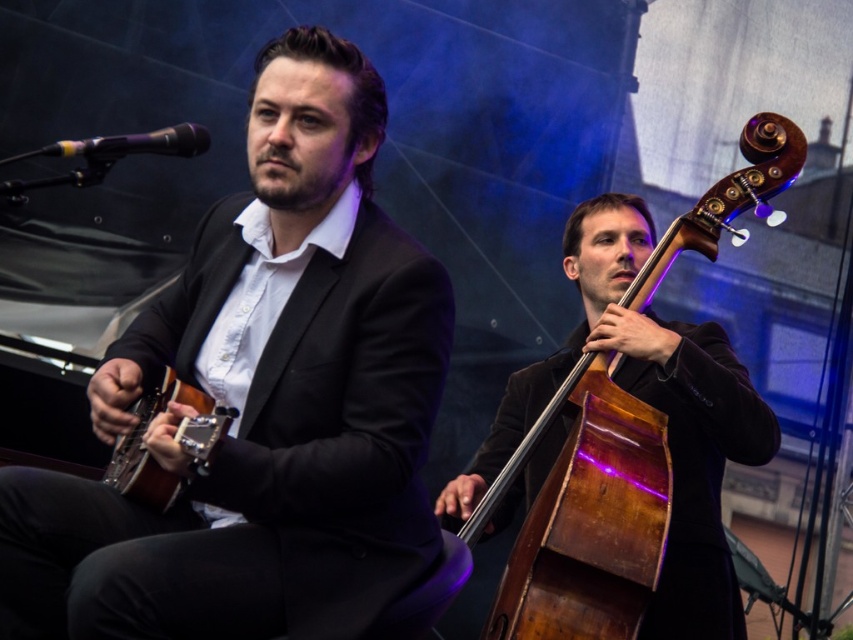
You are a stagehand preparing to move the matte black suit at center and the wooden polished cello at right offstage. Based on their sizes, which object will require more space to store?

The wooden polished cello at right requires more storage space because it is larger than the matte black suit at center.

You are a photographer positioned at the back of the venue. You want to take a photo that includes both the matte black suit at center and the wooden polished cello at right. Which object will appear larger in your photo?

The matte black suit at center will appear larger in the photo since it is closer to the viewer than the wooden polished cello at right.